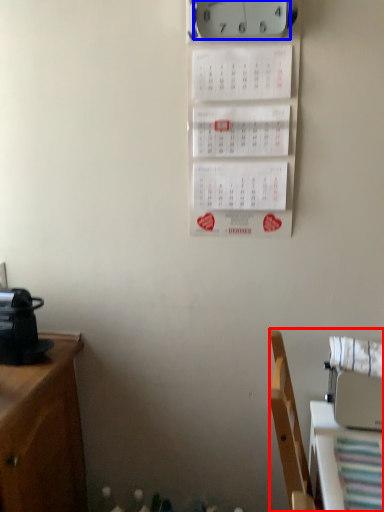
Question: Which object appears farthest to the camera in this image, furniture (highlighted by a red box) or clock (highlighted by a blue box)?

Choices:
 (A) furniture
 (B) clock

Answer: (B)